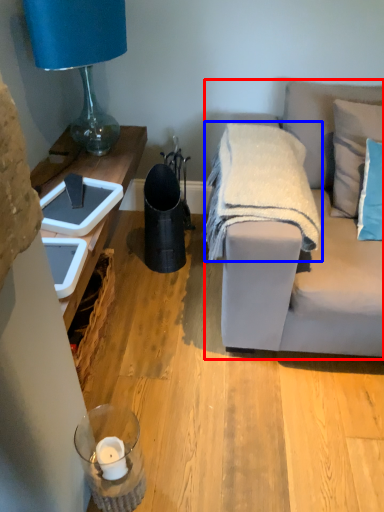
Question: Which of the following is the closest to the observer, studio couch (highlighted by a red box) or blanket (highlighted by a blue box)?

Choices:
 (A) studio couch
 (B) blanket

Answer: (A)